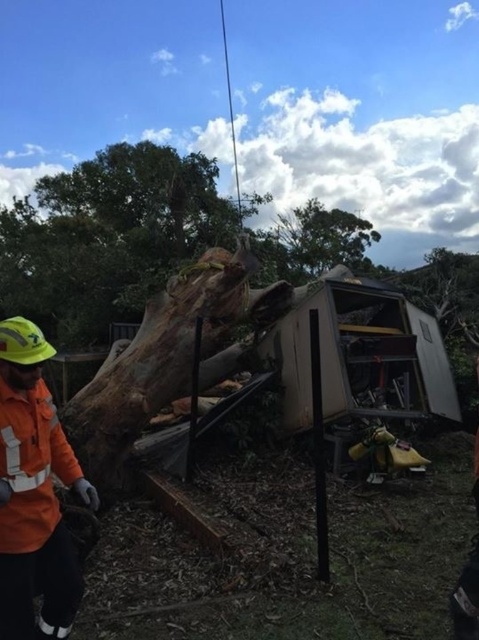
Question: Among these objects, which one is farthest from the camera?

Choices:
 (A) orange reflective jacket at left
 (B) orange fabric safety vest at lower left

Answer: (B)

Question: Which point appears closest to the camera in this image?

Choices:
 (A) (35, 481)
 (B) (31, 330)

Answer: (A)

Question: Is orange reflective jacket at left to the right of orange fabric safety vest at lower left from the viewer's perspective?

Choices:
 (A) no
 (B) yes

Answer: (B)

Question: Is orange reflective jacket at left positioned in front of orange fabric safety vest at lower left?

Choices:
 (A) yes
 (B) no

Answer: (A)

Question: Which object is farther from the camera taking this photo?

Choices:
 (A) orange reflective jacket at left
 (B) orange fabric safety vest at lower left

Answer: (B)

Question: Is orange reflective jacket at left thinner than orange fabric safety vest at lower left?

Choices:
 (A) no
 (B) yes

Answer: (A)